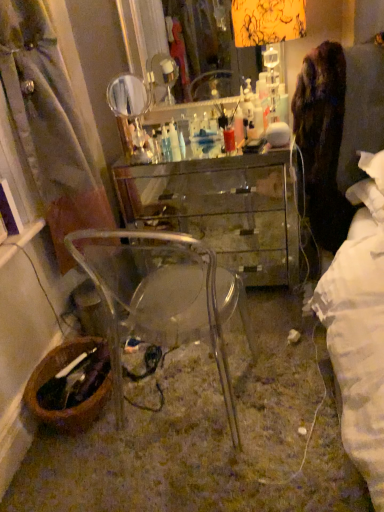
Question: Is transparent glass desk at center to the left or to the right of brown woven picnic basket at lower left in the image?

Choices:
 (A) left
 (B) right

Answer: (B)

Question: Is transparent glass desk at center inside the boundaries of brown woven picnic basket at lower left, or outside?

Choices:
 (A) inside
 (B) outside

Answer: (B)

Question: Estimate the real-world distances between objects in this image. Which object is closer to the clear glass mirror at upper center?

Choices:
 (A) transparent glass desk at center
 (B) transparent plastic chair at lower center
 (C) brown woven picnic basket at lower left

Answer: (A)

Question: Considering the real-world distances, which object is farthest from the brown woven picnic basket at lower left?

Choices:
 (A) clear glass mirror at upper center
 (B) transparent plastic chair at lower center
 (C) transparent glass desk at center

Answer: (C)